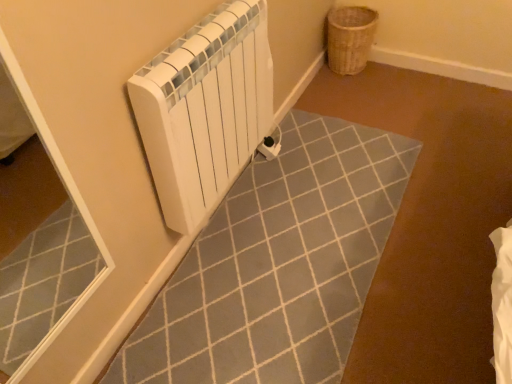
Question: Is white matte radiator at upper left closer to camera compared to woven brown basket at upper right?

Choices:
 (A) no
 (B) yes

Answer: (B)

Question: From the image's perspective, is white matte radiator at upper left above woven brown basket at upper right?

Choices:
 (A) yes
 (B) no

Answer: (B)

Question: Is woven brown basket at upper right at the back of white matte radiator at upper left?

Choices:
 (A) no
 (B) yes

Answer: (A)

Question: Does white matte radiator at upper left have a larger size compared to woven brown basket at upper right?

Choices:
 (A) yes
 (B) no

Answer: (A)

Question: From a real-world perspective, is white matte radiator at upper left located higher than woven brown basket at upper right?

Choices:
 (A) no
 (B) yes

Answer: (B)

Question: From a real-world perspective, does white matte radiator at upper left sit lower than woven brown basket at upper right?

Choices:
 (A) no
 (B) yes

Answer: (A)

Question: From a real-world perspective, is woven brown basket at upper right located higher than white matte radiator at upper left?

Choices:
 (A) yes
 (B) no

Answer: (B)

Question: Are woven brown basket at upper right and white matte radiator at upper left located far from each other?

Choices:
 (A) yes
 (B) no

Answer: (A)

Question: From the image's perspective, would you say woven brown basket at upper right is positioned over white matte radiator at upper left?

Choices:
 (A) yes
 (B) no

Answer: (A)

Question: Is the depth of woven brown basket at upper right less than that of white matte radiator at upper left?

Choices:
 (A) yes
 (B) no

Answer: (B)

Question: From a real-world perspective, is woven brown basket at upper right located beneath white matte radiator at upper left?

Choices:
 (A) yes
 (B) no

Answer: (A)

Question: Is woven brown basket at upper right smaller than white matte radiator at upper left?

Choices:
 (A) no
 (B) yes

Answer: (B)

Question: Choose the correct answer: Is white matte radiator at upper left inside woven brown basket at upper right or outside it?

Choices:
 (A) inside
 (B) outside

Answer: (B)